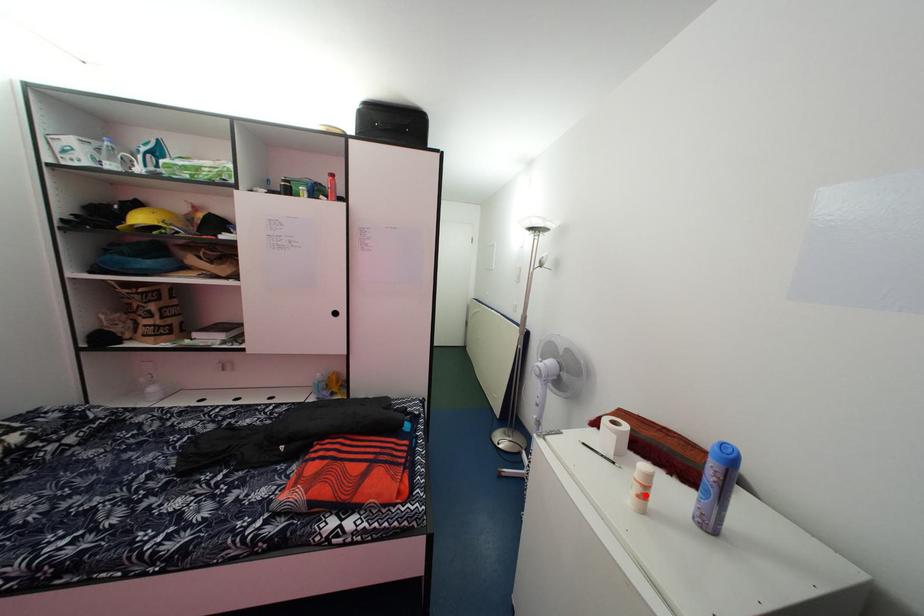
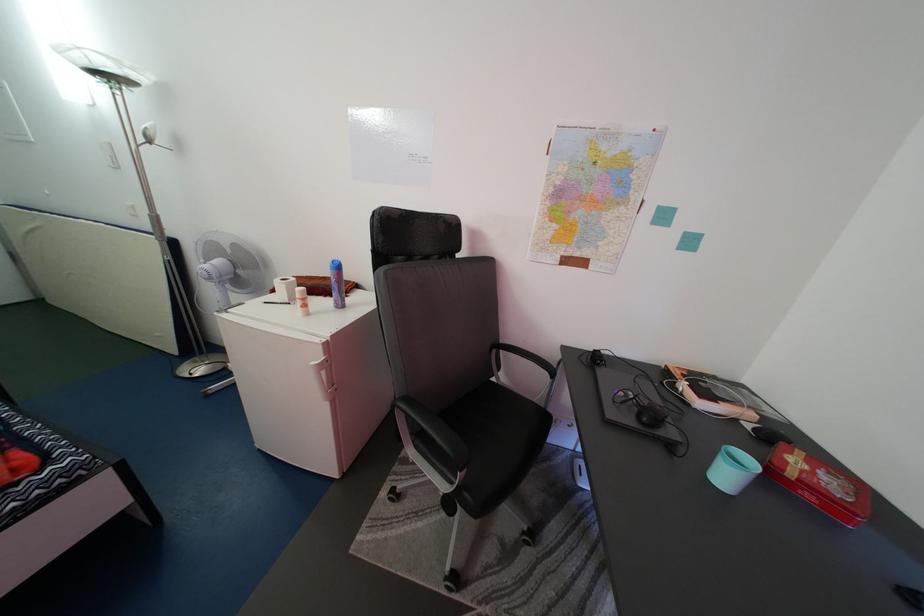
In the second image, find the point that corresponds to the highlighted location in the first image.

(308, 310)